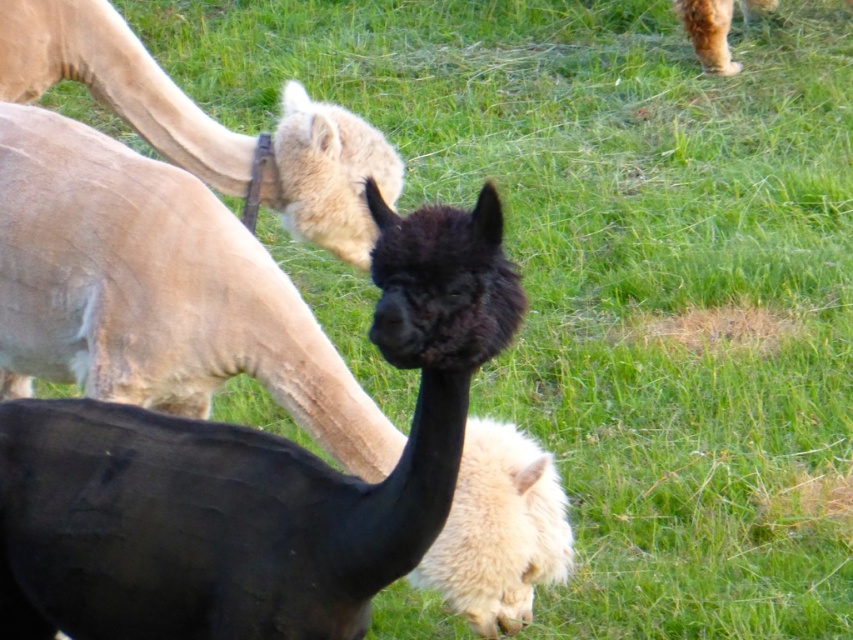
Is black fuzzy alpaca at center positioned at the back of light beige woolen camel at upper left?

That is False.

Who is more distant from viewer, (44,625) or (227,180)?

The point (227,180) is more distant.

Image resolution: width=853 pixels, height=640 pixels. I want to click on black fuzzy alpaca at center, so click(x=252, y=476).